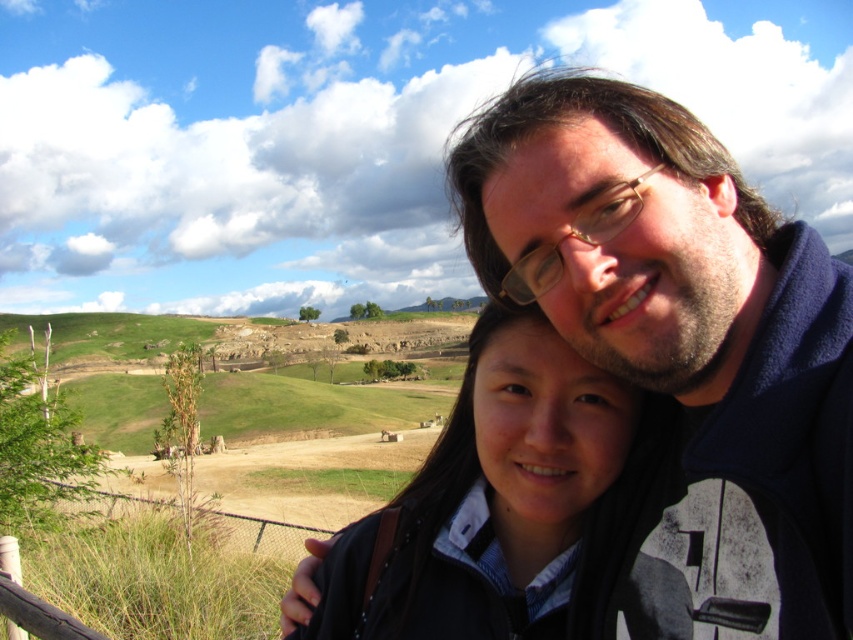
You are a photographer trying to capture the scene. You notice the dark blue fleece at upper right and the dark brown hair at center. Which object would you need to focus on more carefully to ensure it doesn t get lost in the background due to its size?

The dark brown hair at center is smaller in size than the dark blue fleece at upper right, so you should focus more on the dark brown hair at center to prevent it from being overshadowed by the larger fleece.